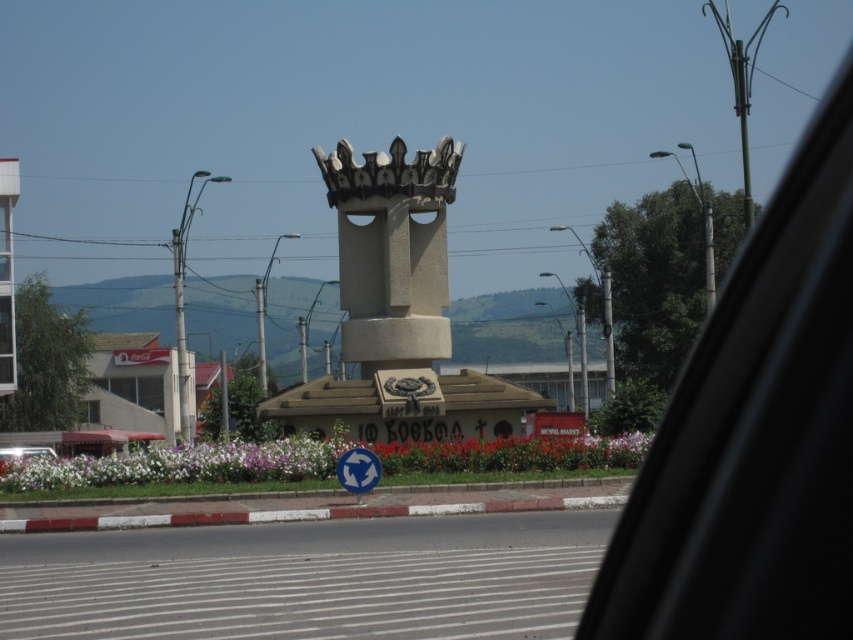
Question: Which point is closer to the camera taking this photo?

Choices:
 (A) (x=364, y=387)
 (B) (x=28, y=458)
 (C) (x=412, y=353)

Answer: (B)

Question: Does gray concrete monument at center appear over white stone monument at center?

Choices:
 (A) no
 (B) yes

Answer: (A)

Question: Which object appears closest to the camera in this image?

Choices:
 (A) white stone monument at center
 (B) metallic silver car at lower left
 (C) gray concrete monument at center
 (D) transparent glass car window at upper right

Answer: (D)

Question: Which object is farther from the camera taking this photo?

Choices:
 (A) gray concrete monument at center
 (B) transparent glass car window at upper right
 (C) white stone monument at center
 (D) metallic silver car at lower left

Answer: (C)

Question: From the image, what is the correct spatial relationship of gray concrete monument at center in relation to white plastic traffic sign at center?

Choices:
 (A) right
 (B) left

Answer: (A)

Question: Can you confirm if transparent glass car window at upper right is positioned above metallic silver car at lower left?

Choices:
 (A) no
 (B) yes

Answer: (B)